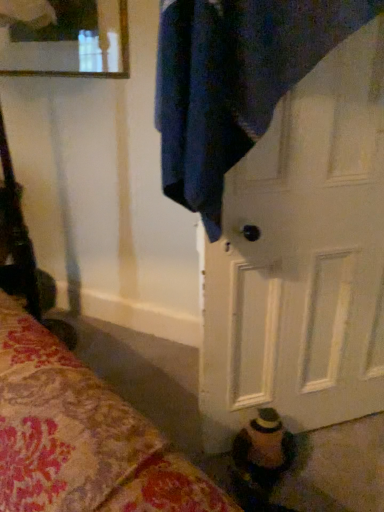
Question: Considering the positions of point (236, 256) and point (97, 22), is point (236, 256) closer or farther from the camera than point (97, 22)?

Choices:
 (A) closer
 (B) farther

Answer: (A)

Question: In the image, is white matte door at center on the left side or the right side of clear glass mirror at upper left?

Choices:
 (A) right
 (B) left

Answer: (A)

Question: Which is correct: white matte door at center is inside clear glass mirror at upper left, or outside of it?

Choices:
 (A) outside
 (B) inside

Answer: (A)

Question: From a real-world perspective, is clear glass mirror at upper left above or below white matte door at center?

Choices:
 (A) above
 (B) below

Answer: (A)

Question: Looking at their shapes, would you say clear glass mirror at upper left is wider or thinner than white matte door at center?

Choices:
 (A) thin
 (B) wide

Answer: (A)

Question: Considering the positions of clear glass mirror at upper left and white matte door at center in the image, is clear glass mirror at upper left taller or shorter than white matte door at center?

Choices:
 (A) short
 (B) tall

Answer: (A)

Question: Is point (13, 39) closer or farther from the camera than point (249, 415)?

Choices:
 (A) closer
 (B) farther

Answer: (B)